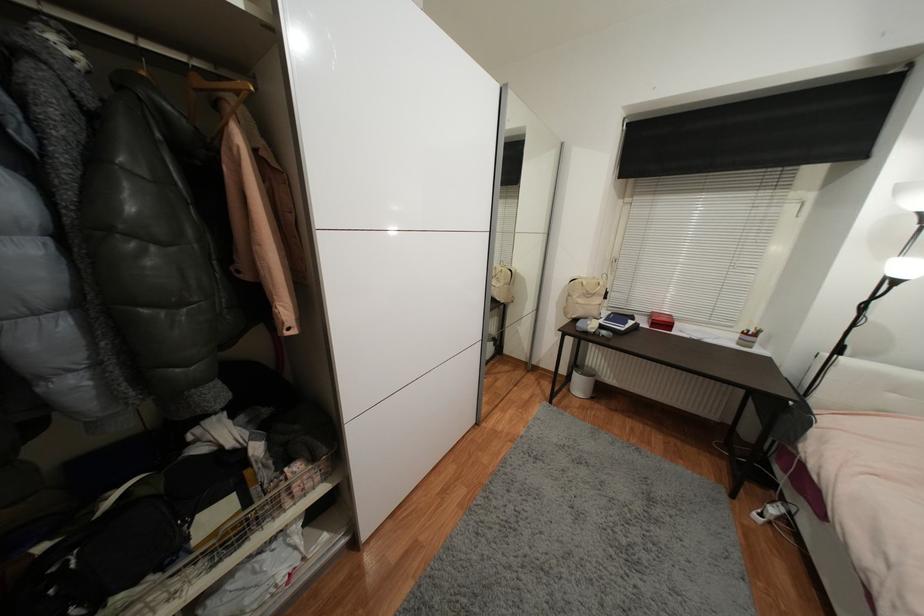
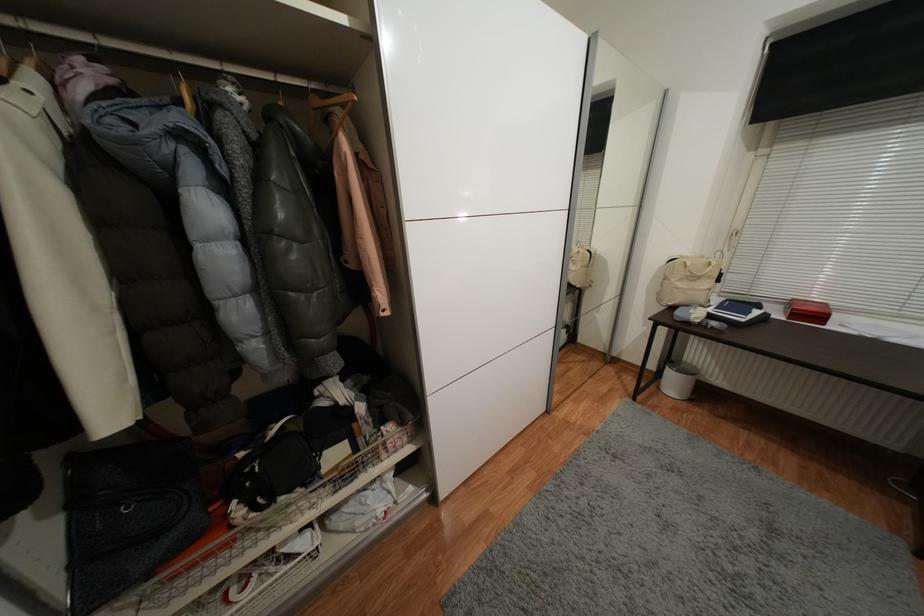
The point at (599, 280) is marked in the first image. Where is the corresponding point in the second image?

(707, 257)